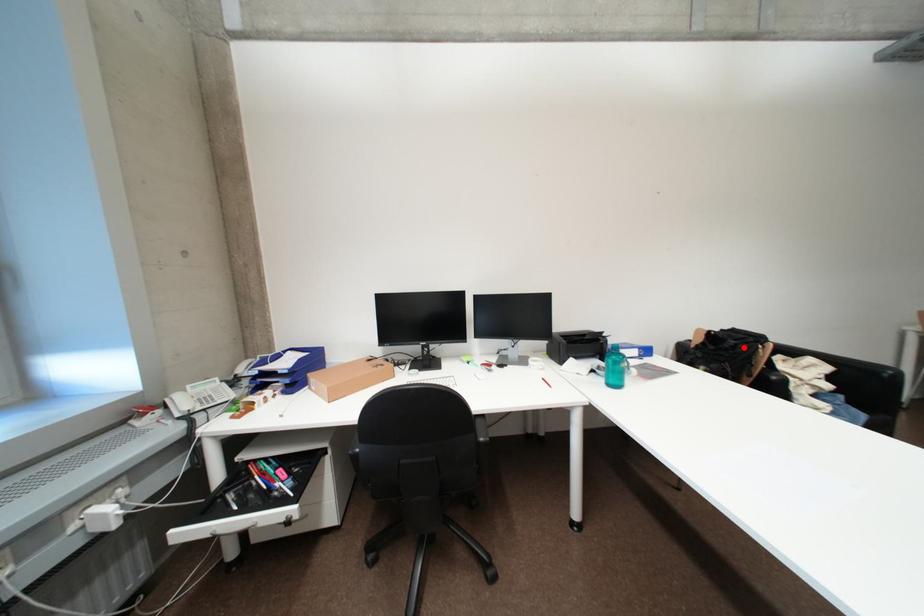
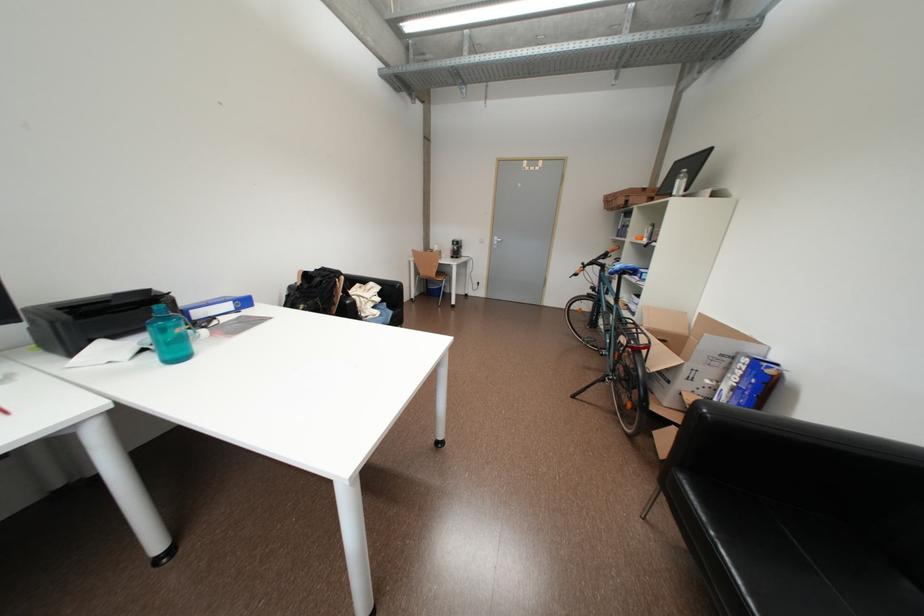
Question: I am providing you with two images of the same scene from different viewpoints. In image1, a red point is highlighted. Considering the same 3D point in image2, which of the following is correct?

Choices:
 (A) It is closer
 (B) It is farther

Answer: (A)